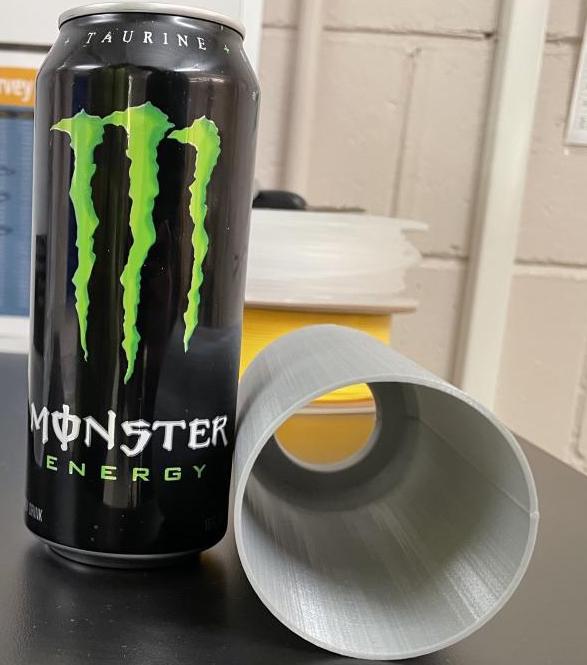
The image size is (587, 665). I want to click on white wall, so (533, 378).